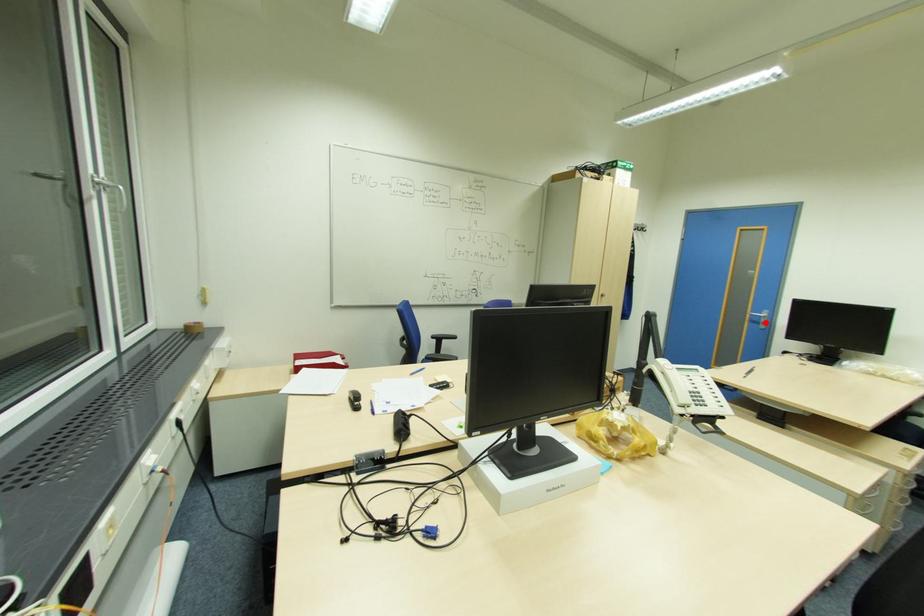
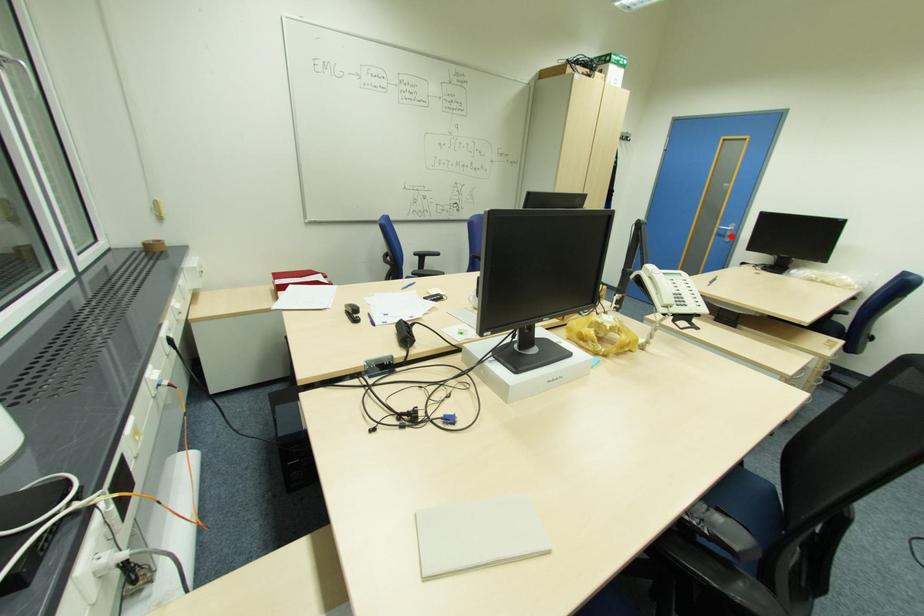
I am providing you with two images of the same scene from different viewpoints. A red point is marked on the first image and another point is marked on the second image. Do the highlighted points in image1 and image2 indicate the same real-world spot?

Yes